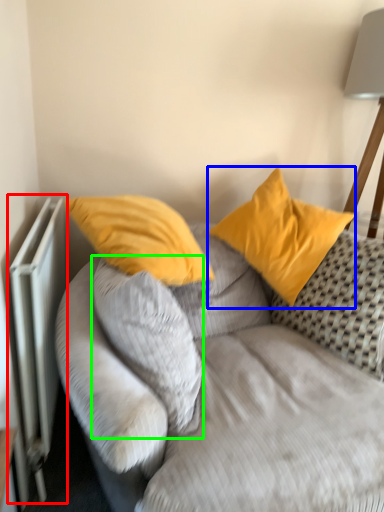
Question: Which object is positioned closest to radiator (highlighted by a red box)? Select from pillow (highlighted by a blue box) and pillow (highlighted by a green box).

Choices:
 (A) pillow
 (B) pillow

Answer: (B)